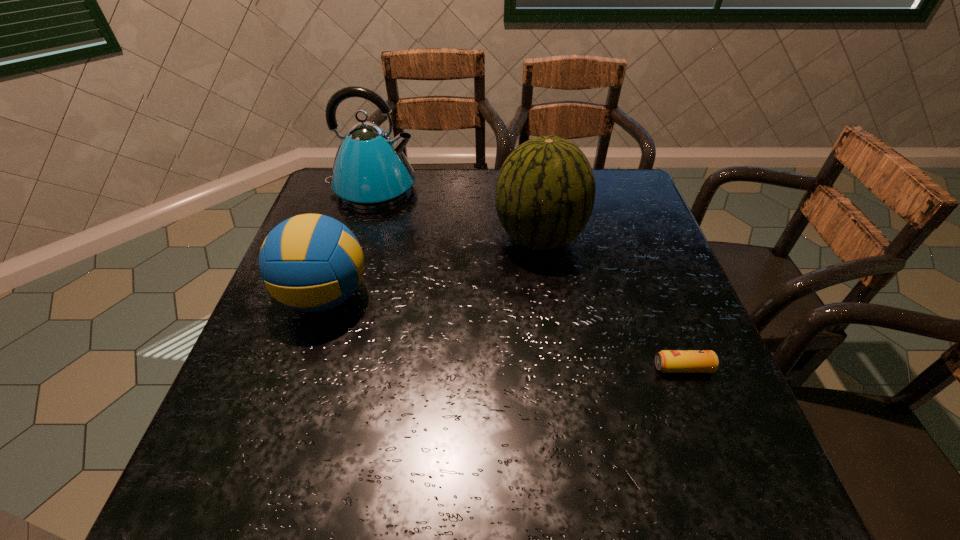
Where is `vacant space that's between the kettle and the shortest object`? This screenshot has width=960, height=540. vacant space that's between the kettle and the shortest object is located at coordinates (528, 279).

Where is `vacant region between the kettle and the watermelon`? This screenshot has width=960, height=540. vacant region between the kettle and the watermelon is located at coordinates (456, 213).

The width and height of the screenshot is (960, 540). Find the location of `vacant area between the kettle and the watermelon`. vacant area between the kettle and the watermelon is located at coordinates (456, 213).

You are a GUI agent. You are given a task and a screenshot of the screen. Output one action in this format:
    pyautogui.click(x=<x>, y=<y>)
    Task: Click on the unoccupied position between the shortest object and the second object from right to left
    This screenshot has height=540, width=960.
    Given the screenshot: What is the action you would take?
    pyautogui.click(x=612, y=302)

Locate an element on the screen. The height and width of the screenshot is (540, 960). free space between the kettle and the nearest object is located at coordinates (528, 279).

In order to click on free spot between the kettle and the second object from right to left in this screenshot , I will do [456, 213].

I want to click on vacant space in between the kettle and the rightmost object, so click(x=528, y=279).

Identify the location of vacant space that's between the shortest object and the kettle. Image resolution: width=960 pixels, height=540 pixels. (528, 279).

Image resolution: width=960 pixels, height=540 pixels. I want to click on free space that is in between the second object from right to left and the kettle, so click(x=456, y=213).

Identify which object is the closest to the volleyball. Please provide its 2D coordinates. Your answer should be formatted as a tuple, i.e. [(x, y)], where the tuple contains the x and y coordinates of a point satisfying the conditions above.

[(370, 171)]